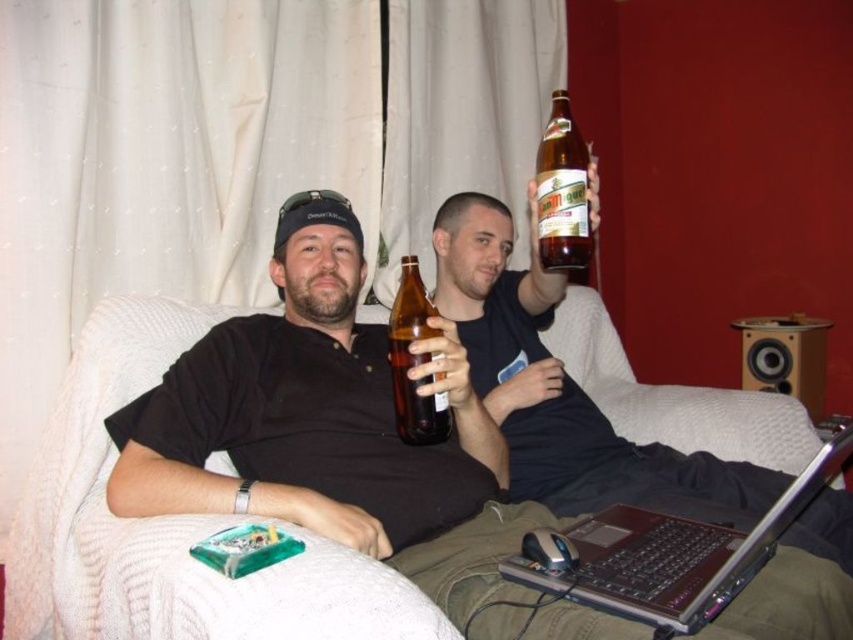
Where is the matte black shirt at center located in the image?

The matte black shirt at center is located at point coordinates of 0.677 on the x axis and 0.389 on the y axis.

You are a photographer setting up a shoot in this scene. You need to place a small prop between the matte black shirt at center and the brown glass bottle at upper center. Based on their heights, which object should the prop be placed closer to?

The matte black shirt at center has a greater height compared to the brown glass bottle at upper center. Therefore, the prop should be placed closer to the brown glass bottle at upper center to balance the composition.

You are a delivery person who needs to place a new brown glass bottle on the shelf. The existing bottles are the brown glass bottle at upper center and the brown glass bottle at center. According to the current arrangement, where should you place the new bottle to maintain the vertical order?

The brown glass bottle at upper center is above the brown glass bottle at center. To maintain the vertical order, place the new brown glass bottle above the brown glass bottle at upper center.